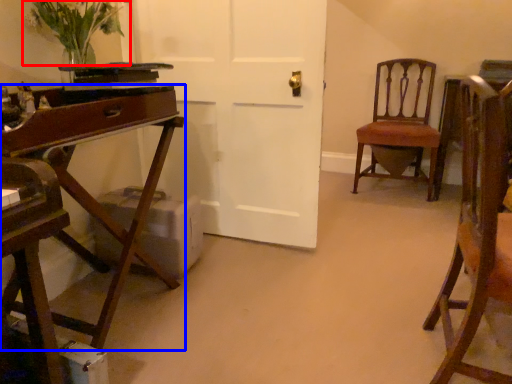
Question: Among these objects, which one is farthest to the camera, floral arrangement (highlighted by a red box) or desk (highlighted by a blue box)?

Choices:
 (A) floral arrangement
 (B) desk

Answer: (A)